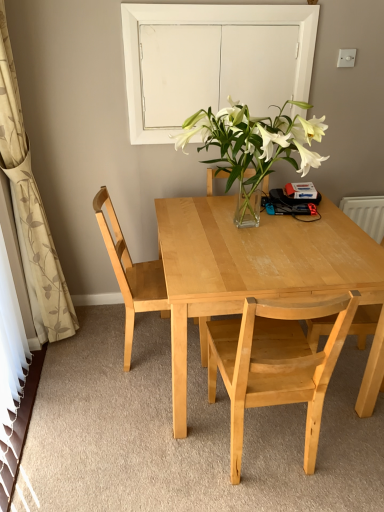
Question: Should I look upward or downward to see white glass door at upper center?

Choices:
 (A) down
 (B) up

Answer: (B)

Question: From a real-world perspective, is light wood chair at center, arranged as the second chair when viewed from the left, below white glass door at upper center?

Choices:
 (A) no
 (B) yes

Answer: (B)

Question: From the image's perspective, is light wood chair at center, arranged as the second chair when viewed from the left, below white glass door at upper center?

Choices:
 (A) no
 (B) yes

Answer: (B)

Question: Is light wood chair at center, arranged as the second chair when viewed from the left, touching white glass door at upper center?

Choices:
 (A) yes
 (B) no

Answer: (B)

Question: Are light wood chair at center, which is the second chair in right-to-left order, and white glass door at upper center far apart?

Choices:
 (A) no
 (B) yes

Answer: (B)

Question: Considering the relative positions of light wood chair at center, arranged as the second chair when viewed from the left, and white glass door at upper center in the image provided, is light wood chair at center, arranged as the second chair when viewed from the left, to the left of white glass door at upper center from the viewer's perspective?

Choices:
 (A) no
 (B) yes

Answer: (A)

Question: Is white glass door at upper center located within light wood chair at center, arranged as the second chair when viewed from the left?

Choices:
 (A) yes
 (B) no

Answer: (B)

Question: From a real-world perspective, is light wood chair at center, which is the second chair in right-to-left order, under light wood chair at left, the third chair from the right?

Choices:
 (A) yes
 (B) no

Answer: (A)

Question: From the image's perspective, is light wood chair at center, arranged as the second chair when viewed from the left, beneath light wood chair at left, which ranks as the 1th chair in left-to-right order?

Choices:
 (A) yes
 (B) no

Answer: (A)

Question: Considering the relative sizes of light wood chair at center, which is the second chair in right-to-left order, and light wood chair at left, which ranks as the 1th chair in left-to-right order, in the image provided, is light wood chair at center, which is the second chair in right-to-left order, taller than light wood chair at left, which ranks as the 1th chair in left-to-right order,?

Choices:
 (A) yes
 (B) no

Answer: (B)

Question: From a real-world perspective, is light wood chair at center, which is the second chair in right-to-left order, positioned over light wood chair at left, which ranks as the 1th chair in left-to-right order, based on gravity?

Choices:
 (A) yes
 (B) no

Answer: (B)

Question: From the image's perspective, would you say light wood chair at center, which is the second chair in right-to-left order, is positioned over light wood chair at left, which ranks as the 1th chair in left-to-right order?

Choices:
 (A) no
 (B) yes

Answer: (A)

Question: Does light wood chair at center, which is the second chair in right-to-left order, have a larger size compared to light wood chair at left, the third chair from the right?

Choices:
 (A) no
 (B) yes

Answer: (B)

Question: Considering the relative sizes of light wood chair at left, which ranks as the 1th chair in left-to-right order, and white glass door at upper center in the image provided, is light wood chair at left, which ranks as the 1th chair in left-to-right order, smaller than white glass door at upper center?

Choices:
 (A) yes
 (B) no

Answer: (B)